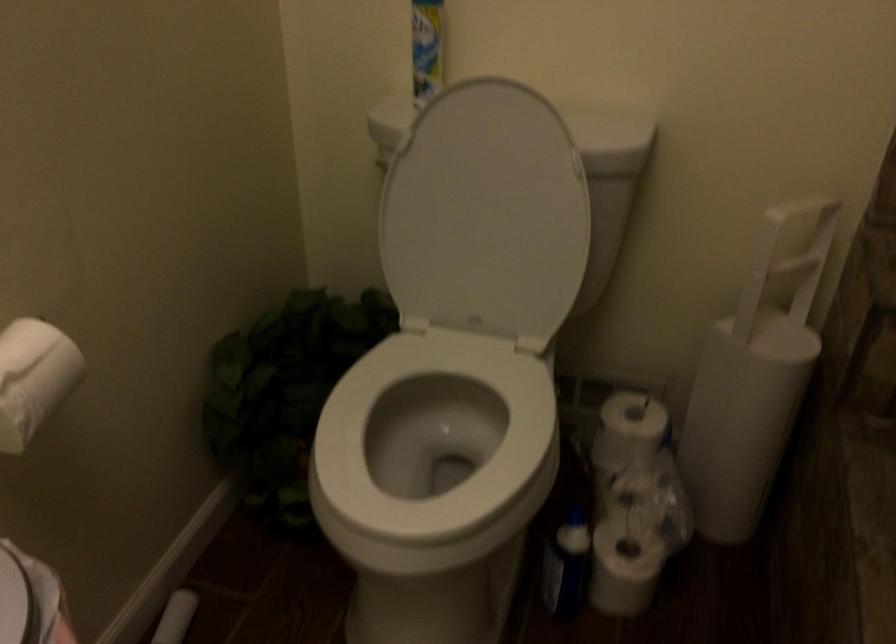
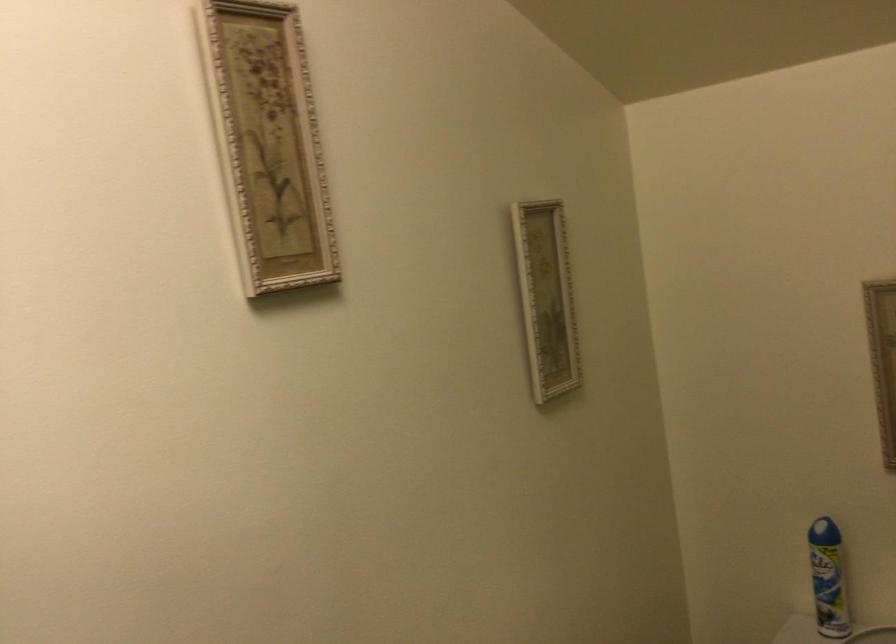
Based on the continuous images, in which direction is the camera rotating?

The camera rotated toward left-up.